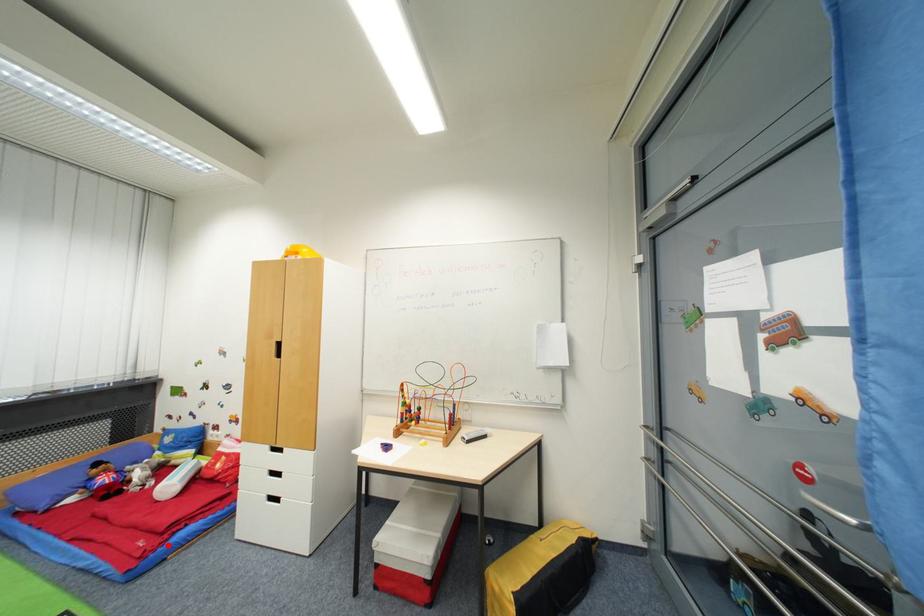
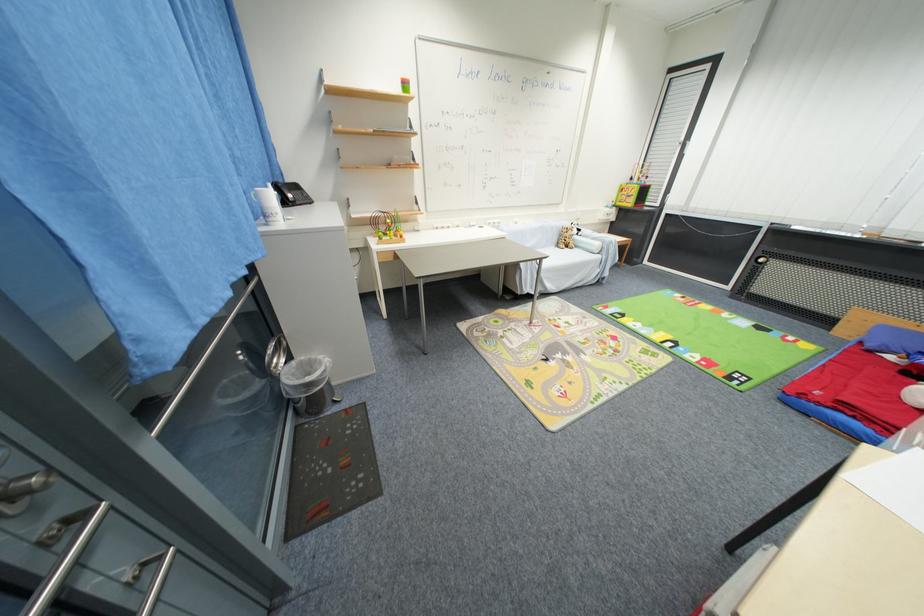
Find the pixel in the second image that matches the highlighted location in the first image.

(824, 406)